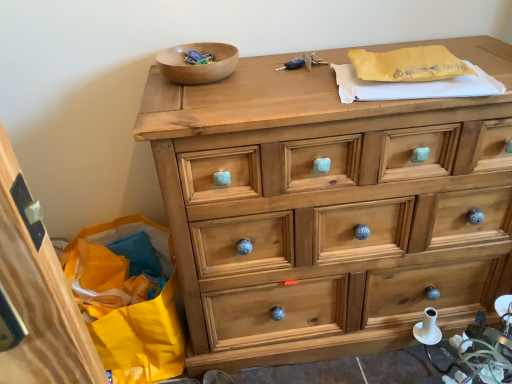
The height and width of the screenshot is (384, 512). Identify the location of vacant area that is situated to the right of wooden bowl at upper center. (271, 62).